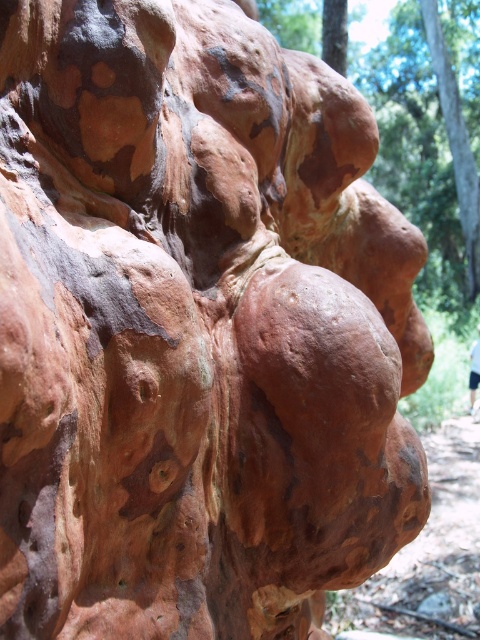
Question: Can you confirm if rustic bark tree trunk at center is positioned below light blue fabric at center?

Choices:
 (A) yes
 (B) no

Answer: (B)

Question: Does rustic bark tree trunk at center lie behind light blue fabric at center?

Choices:
 (A) yes
 (B) no

Answer: (A)

Question: Among these objects, which one is farthest from the camera?

Choices:
 (A) light blue fabric at center
 (B) rustic bark tree trunk at center

Answer: (B)

Question: Is the position of rustic bark tree trunk at center less distant than that of light blue fabric at center?

Choices:
 (A) no
 (B) yes

Answer: (A)

Question: Which point is farther to the camera?

Choices:
 (A) light blue fabric at center
 (B) rustic bark tree trunk at center

Answer: (B)

Question: Among these objects, which one is nearest to the camera?

Choices:
 (A) rustic bark tree trunk at center
 (B) light blue fabric at center

Answer: (B)